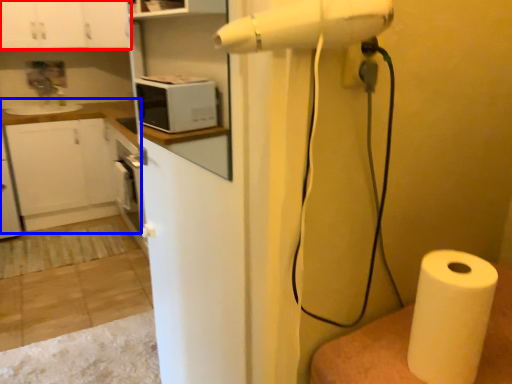
Question: Which object is closer to the camera taking this photo, cabinetry (highlighted by a red box) or counter top (highlighted by a blue box)?

Choices:
 (A) cabinetry
 (B) counter top

Answer: (A)